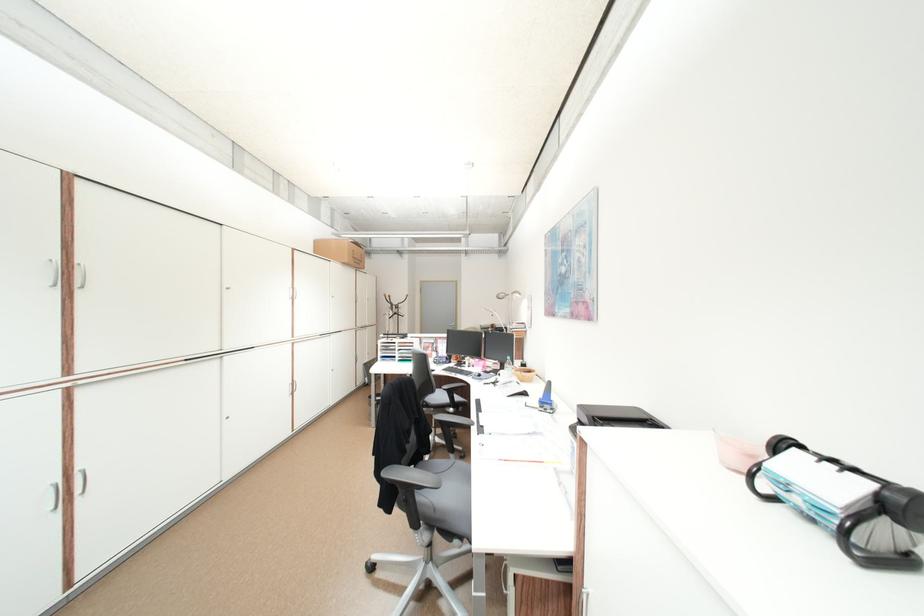
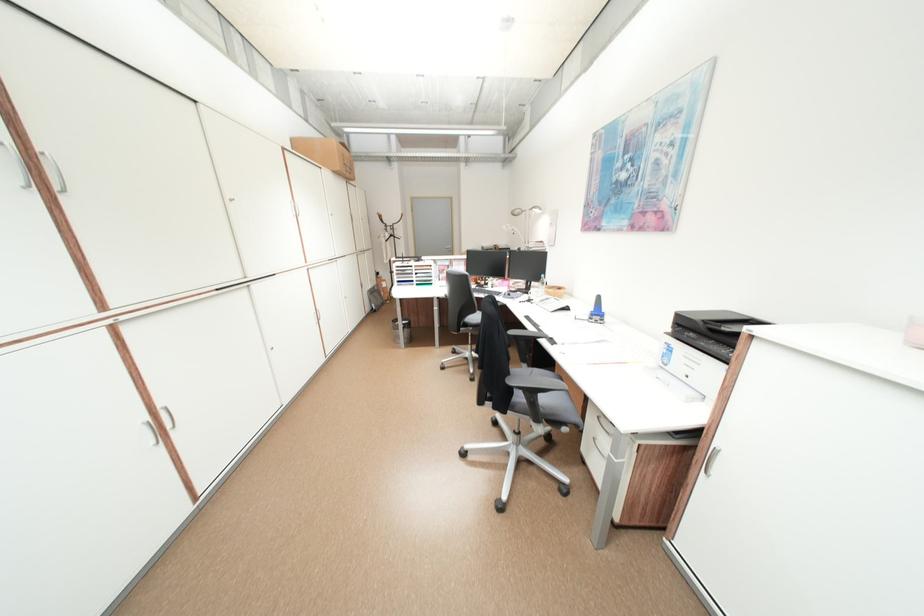
Question: The images are taken continuously from a first-person perspective. In which direction are you moving?

Choices:
 (A) Left
 (B) Right
 (C) Forward
 (D) Backward

Answer: (A)